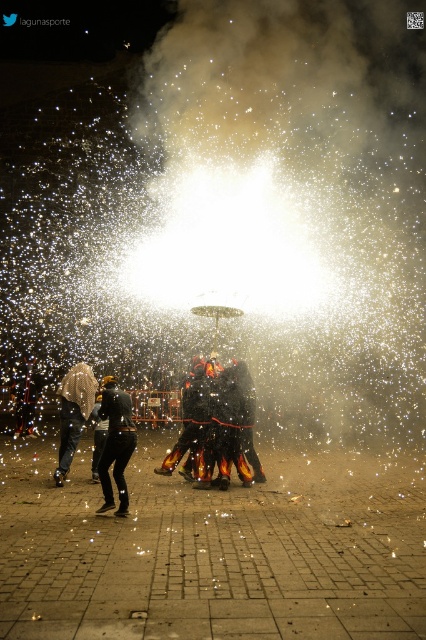
Between black matte/charred figure at center and fuzzy white hair at lower left, which one appears on the left side from the viewer's perspective?

Positioned to the left is fuzzy white hair at lower left.

Who is positioned more to the right, black matte/charred figure at center or fuzzy white hair at lower left?

black matte/charred figure at center is more to the right.

This screenshot has height=640, width=426. In order to click on black matte/charred figure at center in this screenshot , I will do `click(219, 428)`.

Find the location of a particular element. black matte/charred figure at center is located at coordinates (219, 428).

Between black matte pants at lower left and fuzzy white hair at lower left, which one has less height?

fuzzy white hair at lower left is shorter.

Consider the image. Does black matte pants at lower left have a smaller size compared to fuzzy white hair at lower left?

Incorrect, black matte pants at lower left is not smaller in size than fuzzy white hair at lower left.

Where is `black matte pants at lower left`? The width and height of the screenshot is (426, 640). black matte pants at lower left is located at coordinates (115, 444).

Is black matte/charred figure at center to the right of black matte pants at lower left from the viewer's perspective?

Indeed, black matte/charred figure at center is positioned on the right side of black matte pants at lower left.

Is black matte/charred figure at center further to the viewer compared to black matte pants at lower left?

Yes, black matte/charred figure at center is behind black matte pants at lower left.

What do you see at coordinates (219, 428) in the screenshot? This screenshot has height=640, width=426. I see `black matte/charred figure at center` at bounding box center [219, 428].

Where is `black matte/charred figure at center`? The image size is (426, 640). black matte/charred figure at center is located at coordinates (219, 428).